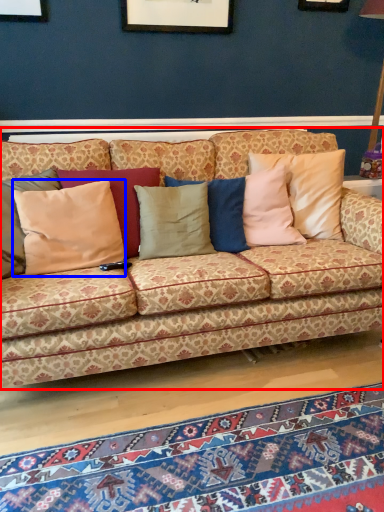
Question: Among these objects, which one is nearest to the camera, studio couch (highlighted by a red box) or pillow (highlighted by a blue box)?

Choices:
 (A) studio couch
 (B) pillow

Answer: (A)